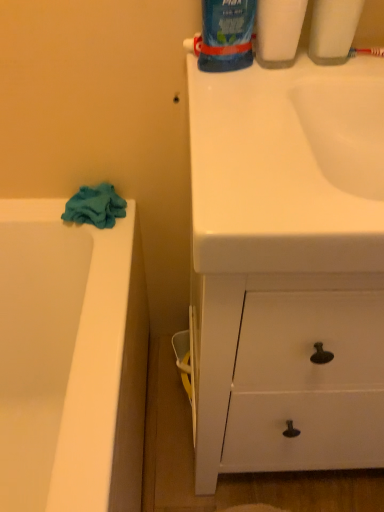
How much space does blue glossy toothpaste at upper center, the 3th cleaning product from the right, occupy horizontally?

It is 3.89 inches.

This screenshot has width=384, height=512. What do you see at coordinates (367, 51) in the screenshot? I see `red plastic toothbrush at upper right` at bounding box center [367, 51].

The height and width of the screenshot is (512, 384). What do you see at coordinates (333, 30) in the screenshot?
I see `blue glossy toothpaste tube at upper right, which is counted as the 1th cleaning product, starting from the right` at bounding box center [333, 30].

Measure the distance between blue glossy toothpaste tube at upper right, which appears as the third cleaning product when viewed from the left, and camera.

They are 64.22 centimeters apart.

Find the location of a particular element. The height and width of the screenshot is (512, 384). teal fabric towel at left is located at coordinates (95, 206).

Does red plastic toothbrush at upper right appear on the left side of blue glossy toothpaste at upper center, which is the 1th cleaning product from left to right?

In fact, red plastic toothbrush at upper right is to the right of blue glossy toothpaste at upper center, which is the 1th cleaning product from left to right.

From the image's perspective, is red plastic toothbrush at upper right above or below blue glossy toothpaste at upper center, which is the 1th cleaning product from left to right?

From the image's perspective, red plastic toothbrush at upper right appears below blue glossy toothpaste at upper center, which is the 1th cleaning product from left to right.

Is red plastic toothbrush at upper right beside blue glossy toothpaste at upper center, the 3th cleaning product from the right?

Result: red plastic toothbrush at upper right and blue glossy toothpaste at upper center, the 3th cleaning product from the right, are not in contact.

Considering the points (350, 55) and (208, 52), which point is in front, point (350, 55) or point (208, 52)?

Point (208, 52)

Which object is closer to the camera, blue glossy bottle at upper center, placed as the second cleaning product when sorted from right to left, or blue glossy toothpaste at upper center, which is the 1th cleaning product from left to right?

blue glossy toothpaste at upper center, which is the 1th cleaning product from left to right, is in front.

Is blue glossy bottle at upper center, placed as the second cleaning product when sorted from right to left, situated inside blue glossy toothpaste at upper center, which is the 1th cleaning product from left to right, or outside?

blue glossy bottle at upper center, placed as the second cleaning product when sorted from right to left, is located beyond the bounds of blue glossy toothpaste at upper center, which is the 1th cleaning product from left to right.

Are blue glossy bottle at upper center, the second cleaning product from the left, and blue glossy toothpaste at upper center, the 3th cleaning product from the right, located far from each other?

No, there isn't a large distance between blue glossy bottle at upper center, the second cleaning product from the left, and blue glossy toothpaste at upper center, the 3th cleaning product from the right.

Is blue glossy bottle at upper center, the second cleaning product from the left, bigger or smaller than blue glossy toothpaste at upper center, which is the 1th cleaning product from left to right?

Considering their sizes, blue glossy bottle at upper center, the second cleaning product from the left, takes up less space than blue glossy toothpaste at upper center, which is the 1th cleaning product from left to right.

Which is further, (211, 24) or (342, 20)?

The point (342, 20) is farther from the camera.

From the image's perspective, would you say blue glossy toothpaste at upper center, which is the 1th cleaning product from left to right, is positioned over blue glossy toothpaste tube at upper right, which appears as the third cleaning product when viewed from the left?

Yes, from the image's perspective, blue glossy toothpaste at upper center, which is the 1th cleaning product from left to right, is over blue glossy toothpaste tube at upper right, which appears as the third cleaning product when viewed from the left.

How many degrees apart are the facing directions of blue glossy toothpaste at upper center, which is the 1th cleaning product from left to right, and blue glossy toothpaste tube at upper right, which is counted as the 1th cleaning product, starting from the right?

There is a 0.963-degree angle between the facing directions of blue glossy toothpaste at upper center, which is the 1th cleaning product from left to right, and blue glossy toothpaste tube at upper right, which is counted as the 1th cleaning product, starting from the right.

Is the position of blue glossy toothpaste at upper center, the 3th cleaning product from the right, less distant than that of blue glossy toothpaste tube at upper right, which appears as the third cleaning product when viewed from the left?

Yes, blue glossy toothpaste at upper center, the 3th cleaning product from the right, is in front of blue glossy toothpaste tube at upper right, which appears as the third cleaning product when viewed from the left.

Considering the points (82, 202) and (355, 49), which point is in front, point (82, 202) or point (355, 49)?

Positioned in front is point (355, 49).

Is teal fabric towel at left oriented away from red plastic toothbrush at upper right?

No, teal fabric towel at left's orientation is not away from red plastic toothbrush at upper right.

Which object is further away from the camera, teal fabric towel at left or red plastic toothbrush at upper right?

teal fabric towel at left is further from the camera.

Is teal fabric towel at left in contact with red plastic toothbrush at upper right?

They are not placed beside each other.

Is point (277, 50) closer or farther from the camera than point (355, 51)?

Point (277, 50) appears to be closer to the viewer than point (355, 51).

Considering the sizes of objects blue glossy bottle at upper center, the second cleaning product from the left, and red plastic toothbrush at upper right in the image provided, who is shorter, blue glossy bottle at upper center, the second cleaning product from the left, or red plastic toothbrush at upper right?

red plastic toothbrush at upper right.

Which is behind, blue glossy bottle at upper center, the second cleaning product from the left, or red plastic toothbrush at upper right?

red plastic toothbrush at upper right is further away from the camera.

Is blue glossy bottle at upper center, placed as the second cleaning product when sorted from right to left, next to red plastic toothbrush at upper right?

No, blue glossy bottle at upper center, placed as the second cleaning product when sorted from right to left, is not in contact with red plastic toothbrush at upper right.

How much distance is there between blue glossy bottle at upper center, placed as the second cleaning product when sorted from right to left, and teal fabric towel at left?

The distance of blue glossy bottle at upper center, placed as the second cleaning product when sorted from right to left, from teal fabric towel at left is 17.57 inches.

From a real-world perspective, is blue glossy bottle at upper center, placed as the second cleaning product when sorted from right to left, positioned over teal fabric towel at left based on gravity?

Yes, from a real-world perspective, blue glossy bottle at upper center, placed as the second cleaning product when sorted from right to left, is on top of teal fabric towel at left.

Is point (277, 26) behind point (86, 209)?

No.

Which is more to the left, blue glossy bottle at upper center, placed as the second cleaning product when sorted from right to left, or teal fabric towel at left?

From the viewer's perspective, teal fabric towel at left appears more on the left side.

Choose the correct answer: Is blue glossy toothpaste at upper center, which is the 1th cleaning product from left to right, inside red plastic toothbrush at upper right or outside it?

blue glossy toothpaste at upper center, which is the 1th cleaning product from left to right, is spatially situated outside red plastic toothbrush at upper right.

From a real-world perspective, who is located lower, blue glossy toothpaste at upper center, the 3th cleaning product from the right, or red plastic toothbrush at upper right?

red plastic toothbrush at upper right, from a real-world perspective.

Is blue glossy toothpaste at upper center, the 3th cleaning product from the right, far away from red plastic toothbrush at upper right?

No, blue glossy toothpaste at upper center, the 3th cleaning product from the right, is not far from red plastic toothbrush at upper right.

Locate an element on the screen. toothbrush that appears on the right of blue glossy toothpaste at upper center, the 3th cleaning product from the right is located at coordinates (367, 51).

Find the location of a particular element. This screenshot has width=384, height=512. cleaning product on the left of blue glossy bottle at upper center, the second cleaning product from the left is located at coordinates (225, 35).

Looking at the image, which one is located further to blue glossy toothpaste at upper center, which is the 1th cleaning product from left to right, blue glossy toothpaste tube at upper right, which is counted as the 1th cleaning product, starting from the right, or red plastic toothbrush at upper right?

Among the two, red plastic toothbrush at upper right is located further to blue glossy toothpaste at upper center, which is the 1th cleaning product from left to right.

Looking at the image, which one is located further to blue glossy toothpaste at upper center, which is the 1th cleaning product from left to right, teal fabric towel at left or red plastic toothbrush at upper right?

Among the two, teal fabric towel at left is located further to blue glossy toothpaste at upper center, which is the 1th cleaning product from left to right.

Which object lies nearer to the anchor point blue glossy toothpaste tube at upper right, which is counted as the 1th cleaning product, starting from the right, red plastic toothbrush at upper right or blue glossy bottle at upper center, the second cleaning product from the left?

The object closer to blue glossy toothpaste tube at upper right, which is counted as the 1th cleaning product, starting from the right, is red plastic toothbrush at upper right.

Considering their positions, is blue glossy toothpaste tube at upper right, which appears as the third cleaning product when viewed from the left, positioned further to blue glossy bottle at upper center, placed as the second cleaning product when sorted from right to left, than blue glossy toothpaste at upper center, which is the 1th cleaning product from left to right?

blue glossy toothpaste tube at upper right, which appears as the third cleaning product when viewed from the left, is further to blue glossy bottle at upper center, placed as the second cleaning product when sorted from right to left.

Estimate the real-world distances between objects in this image. Which object is further from blue glossy toothpaste at upper center, the 3th cleaning product from the right, red plastic toothbrush at upper right or blue glossy toothpaste tube at upper right, which is counted as the 1th cleaning product, starting from the right?

Based on the image, red plastic toothbrush at upper right appears to be further to blue glossy toothpaste at upper center, the 3th cleaning product from the right.

When comparing their distances from blue glossy bottle at upper center, placed as the second cleaning product when sorted from right to left, does teal fabric towel at left or red plastic toothbrush at upper right seem further?

teal fabric towel at left lies further to blue glossy bottle at upper center, placed as the second cleaning product when sorted from right to left, than the other object.

When comparing their distances from blue glossy bottle at upper center, placed as the second cleaning product when sorted from right to left, does teal fabric towel at left or blue glossy toothpaste tube at upper right, which is counted as the 1th cleaning product, starting from the right, seem further?

The object further to blue glossy bottle at upper center, placed as the second cleaning product when sorted from right to left, is teal fabric towel at left.

Looking at this image, which object lies further to the anchor point teal fabric towel at left, blue glossy toothpaste at upper center, the 3th cleaning product from the right, or blue glossy bottle at upper center, placed as the second cleaning product when sorted from right to left?

Based on the image, blue glossy bottle at upper center, placed as the second cleaning product when sorted from right to left, appears to be further to teal fabric towel at left.

This screenshot has width=384, height=512. I want to click on cleaning product situated between teal fabric towel at left and blue glossy bottle at upper center, the second cleaning product from the left, from left to right, so click(x=225, y=35).

The height and width of the screenshot is (512, 384). In order to click on cleaning product between blue glossy bottle at upper center, placed as the second cleaning product when sorted from right to left, and red plastic toothbrush at upper right, in the horizontal direction in this screenshot , I will do `click(333, 30)`.

Find the location of a particular element. cleaning product located between blue glossy toothpaste at upper center, the 3th cleaning product from the right, and blue glossy toothpaste tube at upper right, which is counted as the 1th cleaning product, starting from the right, in the left-right direction is located at coordinates (278, 31).